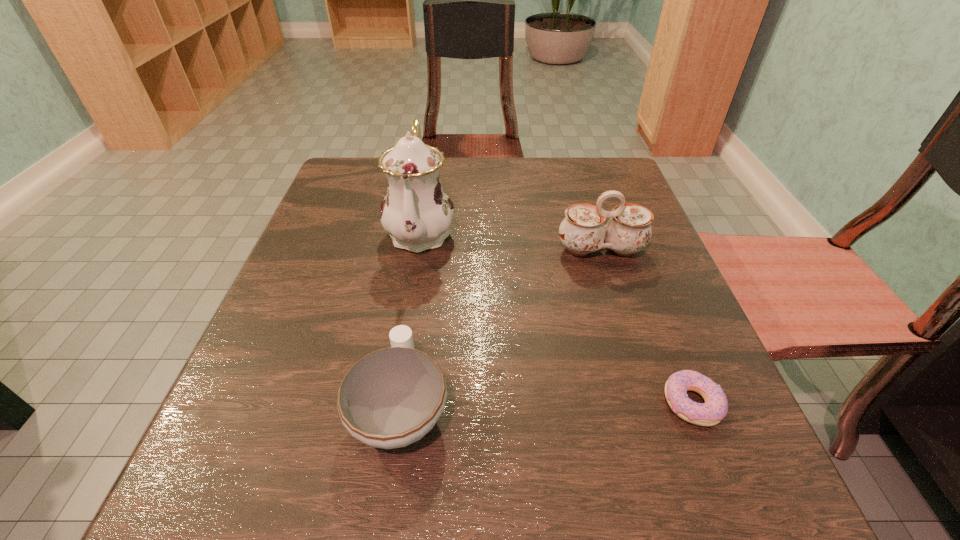
Where is `free location located 0.350m on the side with the handle of the nearest chinaware`? Image resolution: width=960 pixels, height=540 pixels. free location located 0.350m on the side with the handle of the nearest chinaware is located at coordinates (427, 225).

Locate an element on the screen. Image resolution: width=960 pixels, height=540 pixels. vacant space located on the left of the doughnut is located at coordinates (429, 403).

Locate an element on the screen. The height and width of the screenshot is (540, 960). object present at the far edge is located at coordinates (417, 213).

The height and width of the screenshot is (540, 960). Find the location of `object that is at the near edge`. object that is at the near edge is located at coordinates (391, 398).

Where is `chinaware positioned at the right edge`? chinaware positioned at the right edge is located at coordinates (582, 231).

Identify the location of doughnut that is at the right edge. The image size is (960, 540). (710, 413).

In the image, there is a desktop. Find the location of `free region at the far edge`. free region at the far edge is located at coordinates (489, 183).

At what (x,y) coordinates should I click in order to perform the action: click on vacant space at the near edge of the desktop. Please return your answer as a coordinate pair (x, y). The height and width of the screenshot is (540, 960). Looking at the image, I should click on (367, 489).

The width and height of the screenshot is (960, 540). In the image, there is a desktop. In order to click on vacant space at the left edge in this screenshot , I will do `click(276, 450)`.

Find the location of a particular element. free space at the right edge of the desktop is located at coordinates (656, 377).